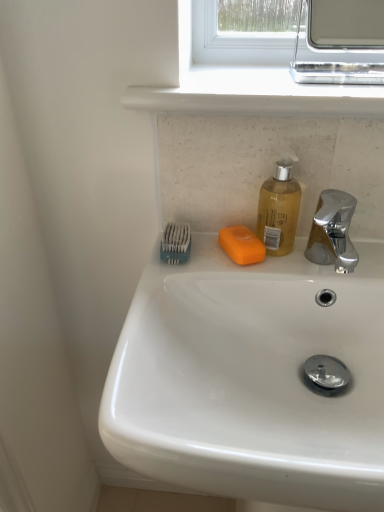
This screenshot has height=512, width=384. I want to click on free spot in front of orange matte soap at center, so click(x=230, y=284).